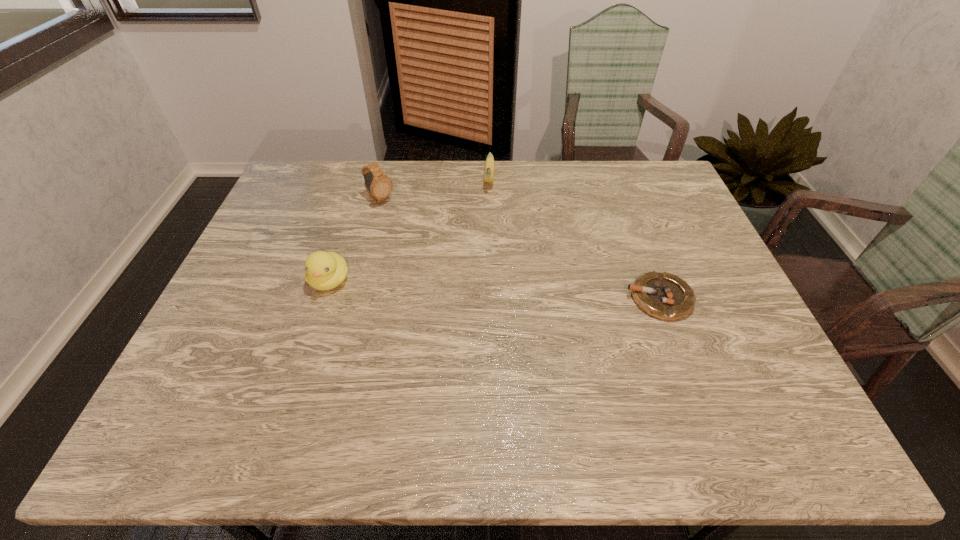
The image size is (960, 540). I want to click on duckling, so click(324, 270).

Find the location of a particular element. the rightmost object is located at coordinates (665, 296).

Where is `ashtray`? The height and width of the screenshot is (540, 960). ashtray is located at coordinates (665, 296).

Locate an element on the screen. watch is located at coordinates (379, 187).

Locate an element on the screen. the third object from left to right is located at coordinates (489, 165).

This screenshot has width=960, height=540. In order to click on banana in this screenshot , I will do `click(489, 165)`.

At what (x,y) coordinates should I click in order to perform the action: click on vacant space situated at the beak of the duckling. Please return your answer as a coordinate pair (x, y). Looking at the image, I should click on (314, 327).

You are a GUI agent. You are given a task and a screenshot of the screen. Output one action in this format:
    pyautogui.click(x=<x>, y=<y>)
    Task: Click on the vacant area located on the back of the rightmost object
    
    Given the screenshot: What is the action you would take?
    pyautogui.click(x=624, y=204)

You are a GUI agent. You are given a task and a screenshot of the screen. Output one action in this format:
    pyautogui.click(x=<x>, y=<y>)
    Task: Click on the vacant space located on the face of the watch
    
    Given the screenshot: What is the action you would take?
    pyautogui.click(x=410, y=224)

Where is `vacant region located 0.380m on the face of the watch`? The height and width of the screenshot is (540, 960). vacant region located 0.380m on the face of the watch is located at coordinates 471,269.